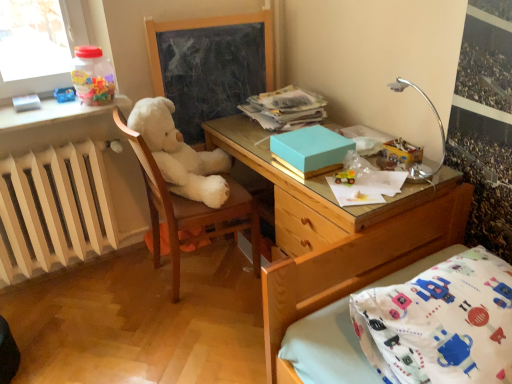
Question: Relative to transparent plastic container at upper left, is white painted radiator at left in front or behind?

Choices:
 (A) behind
 (B) front

Answer: (B)

Question: Based on their sizes in the image, would you say white painted radiator at left is bigger or smaller than transparent plastic container at upper left?

Choices:
 (A) small
 (B) big

Answer: (B)

Question: Which object is positioned farthest from the transparent plastic container at upper left?

Choices:
 (A) yellow rubber toy car at center, the 2th toy in the back-to-front sequence
 (B) wooden bed frame at lower right
 (C) smooth blackboard at center
 (D) silver metallic desk lamp at upper right
 (E) white painted radiator at left

Answer: (B)

Question: Considering the real-world distances, which object is farthest from the silver metallic desk lamp at upper right?

Choices:
 (A) white wood chair at center
 (B) white painted radiator at left
 (C) matte brown teddy bear at upper right, acting as the second toy starting from the left
 (D) smooth blackboard at center
 (E) wooden desk at center

Answer: (B)